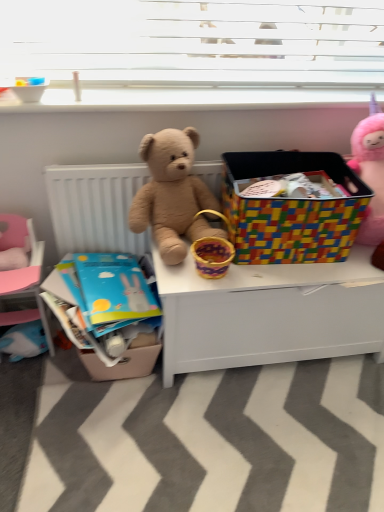
Question: Based on their sizes in the image, would you say matte cardboard crate at lower left is bigger or smaller than fuzzy brown teddy bear at center?

Choices:
 (A) big
 (B) small

Answer: (B)

Question: From the image's perspective, is matte cardboard crate at lower left above or below fuzzy brown teddy bear at center?

Choices:
 (A) below
 (B) above

Answer: (A)

Question: Based on their relative distances, which object is nearer to the white smooth window sill at upper center?

Choices:
 (A) fuzzy brown teddy bear at center
 (B) white matte desk at center
 (C) fluffy pink unicorn at upper right
 (D) matte cardboard crate at lower left
 (E) pink fabric bed at lower left

Answer: (A)

Question: Estimate the real-world distances between objects in this image. Which object is closer to the multicolored plastic storage bin at center?

Choices:
 (A) white matte desk at center
 (B) pink fabric bed at lower left
 (C) matte cardboard crate at lower left
 (D) fluffy pink unicorn at upper right
 (E) white smooth window sill at upper center

Answer: (D)